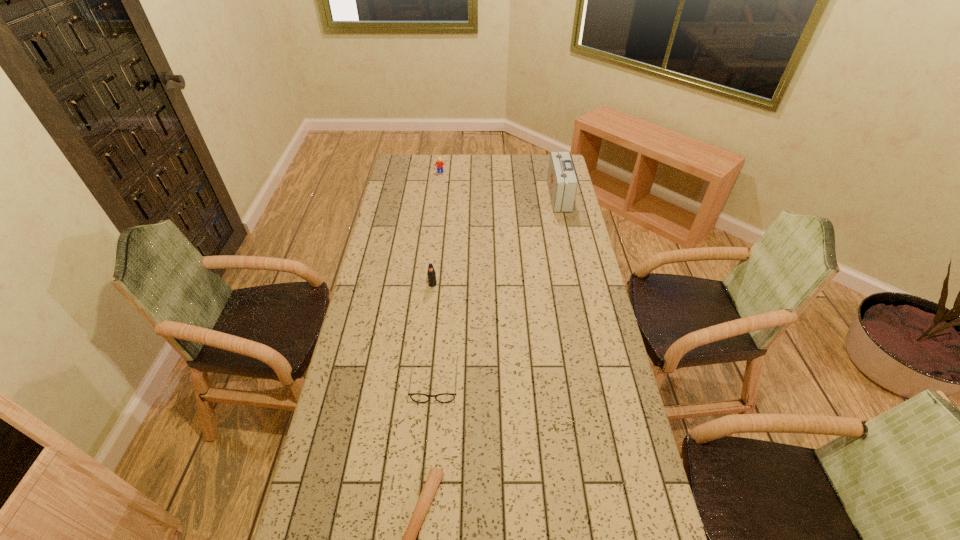
At what (x,y) coordinates should I click in order to perform the action: click on vacant region located on the front-facing side of the rightmost object. Please return your answer as a coordinate pair (x, y). The width and height of the screenshot is (960, 540). Looking at the image, I should click on (514, 196).

I want to click on free space located on the front label of the pop, so 430,305.

The width and height of the screenshot is (960, 540). Identify the location of free point located on the front-facing side of the third shortest object. (436, 206).

At what (x,y) coordinates should I click in order to perform the action: click on vacant space situated through the lenses of the fourth farthest object. Please return your answer as a coordinate pair (x, y). Looking at the image, I should click on (423, 522).

Find the location of a particular element. object at the far edge is located at coordinates [439, 163].

Locate an element on the screen. The image size is (960, 540). object present at the right edge is located at coordinates (562, 183).

The height and width of the screenshot is (540, 960). In the image, there is a desktop. In order to click on free region at the far edge in this screenshot , I will do pyautogui.click(x=533, y=167).

Where is `vacant space at the left edge of the desktop`? vacant space at the left edge of the desktop is located at coordinates coord(353,508).

Where is `vacant space at the right edge`? The width and height of the screenshot is (960, 540). vacant space at the right edge is located at coordinates 624,396.

The width and height of the screenshot is (960, 540). What are the coordinates of `free spot between the second nearest object and the third shortest object` in the screenshot? It's located at (438, 276).